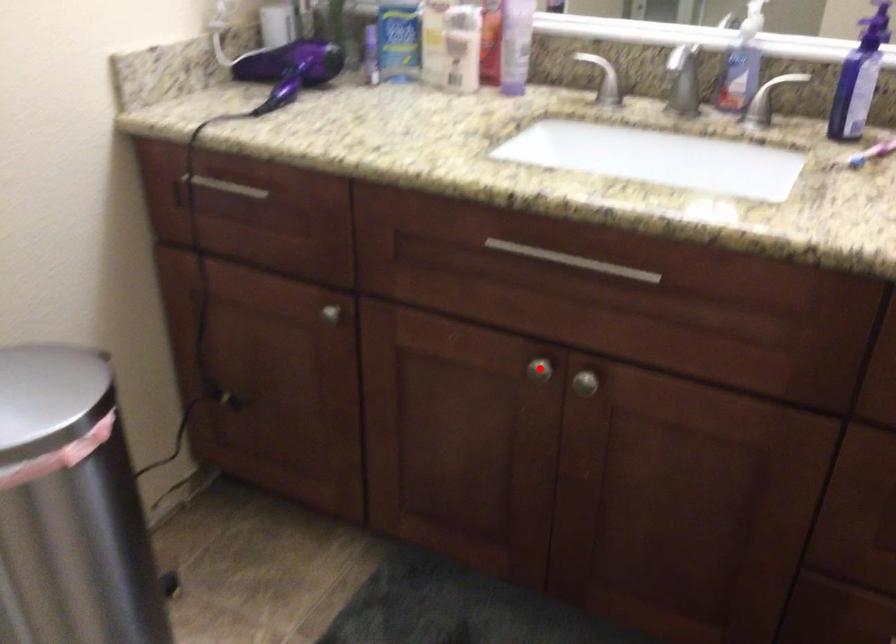
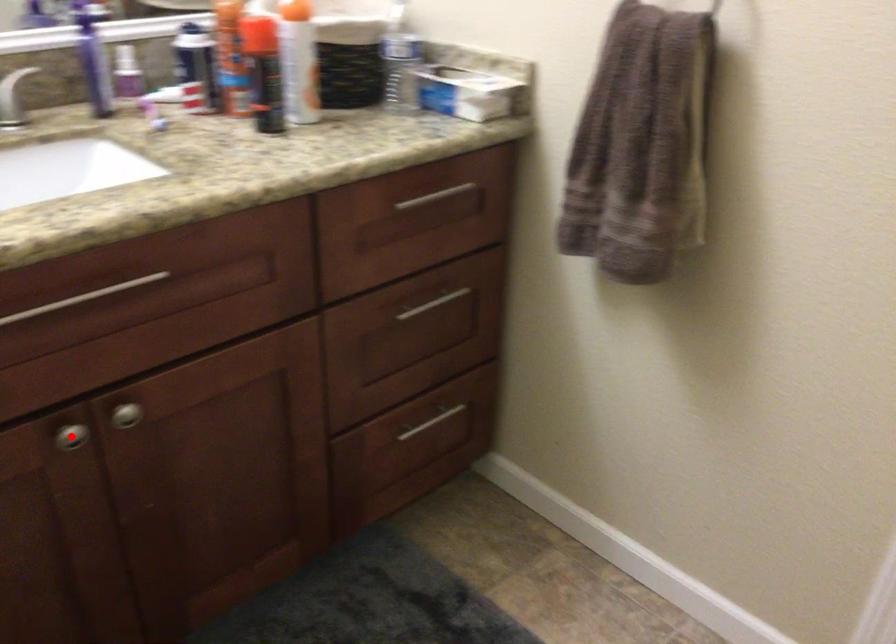
I am providing you with two images of the same scene from different viewpoints. A red point is marked on the first image and another point is marked on the second image. Does the point marked in image1 correspond to the same location as the one in image2?

Yes